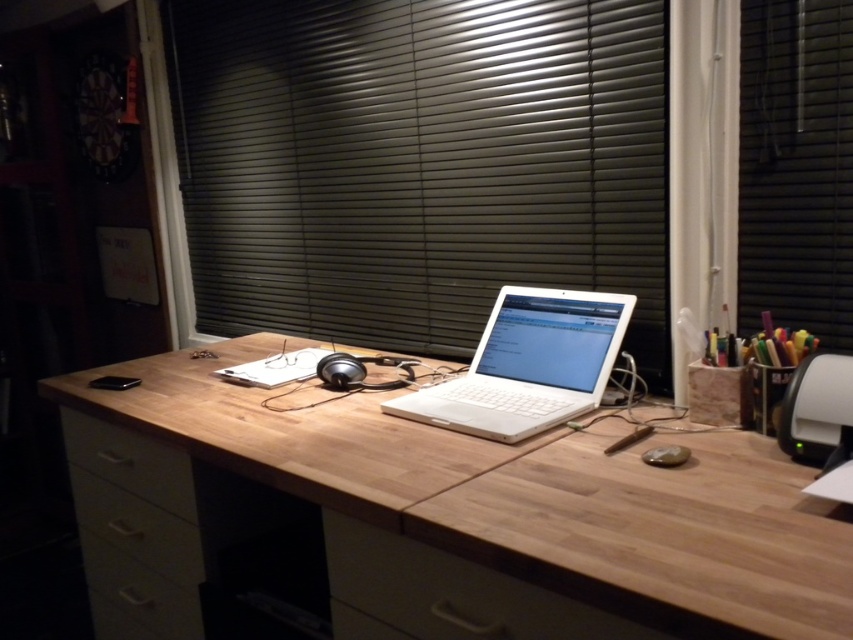
Question: Is white matte laptop at center bigger than matte black mouse at center?

Choices:
 (A) yes
 (B) no

Answer: (A)

Question: Which point is farther to the camera?

Choices:
 (A) (375, 250)
 (B) (90, 515)
 (C) (404, 381)
 (D) (679, 451)

Answer: (A)

Question: Does white matte laptop at center have a larger size compared to matte black mouse at center?

Choices:
 (A) no
 (B) yes

Answer: (B)

Question: Which object is farther from the camera taking this photo?

Choices:
 (A) wooden drawer at center
 (B) white matte drawer at lower left

Answer: (B)

Question: Is the position of white matte laptop at center more distant than that of satin silver earphone at center?

Choices:
 (A) yes
 (B) no

Answer: (B)

Question: Which object is the closest to the white matte drawer at lower left?

Choices:
 (A) wooden desk at center
 (B) wooden drawer at lower left

Answer: (B)